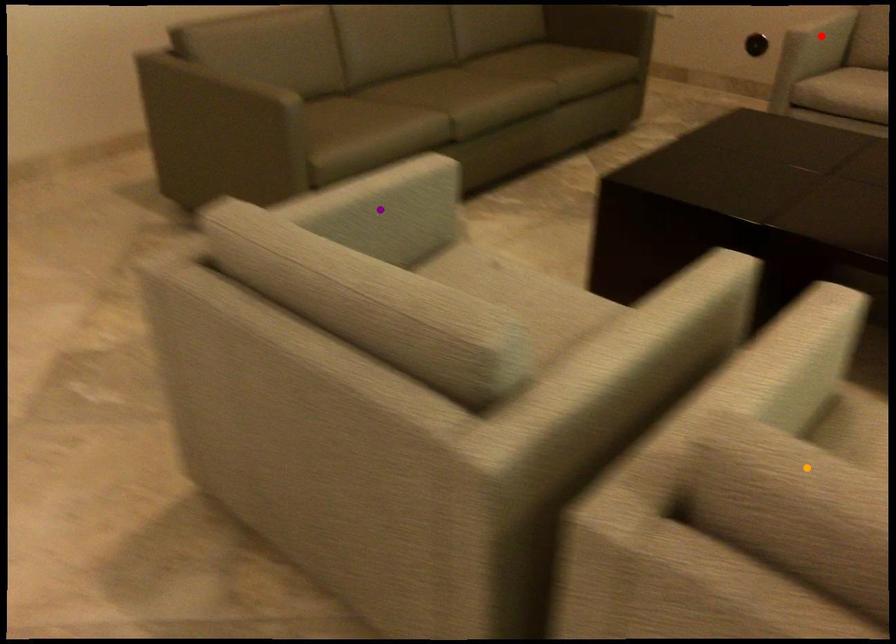
Order these from nearest to farthest:
- orange point
- purple point
- red point

orange point, purple point, red point